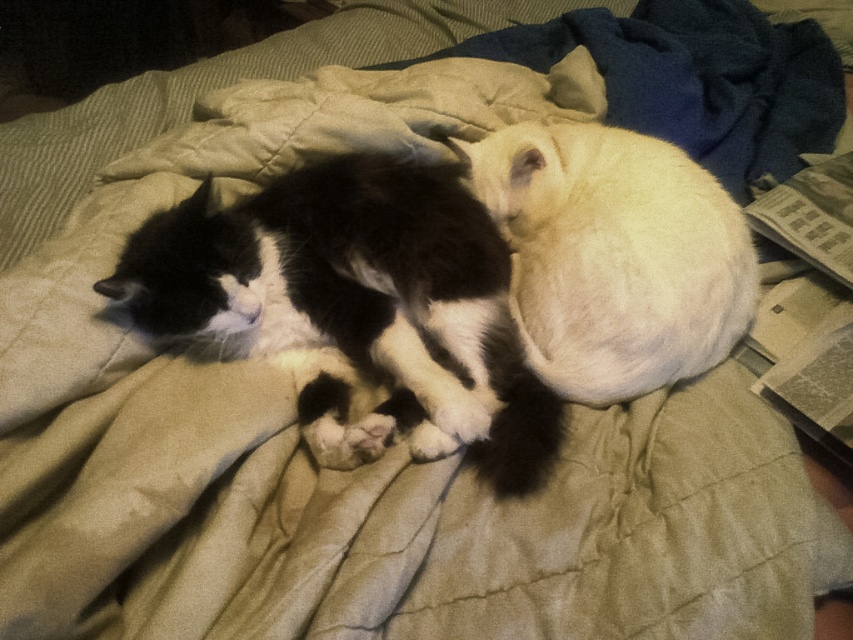
Question: Does black and white fur cat at center appear on the right side of white fluffy cat at center?

Choices:
 (A) yes
 (B) no

Answer: (B)

Question: Does black and white fur cat at center come in front of white fluffy cat at center?

Choices:
 (A) no
 (B) yes

Answer: (B)

Question: Can you confirm if black and white fur cat at center is positioned to the left of white fluffy cat at center?

Choices:
 (A) yes
 (B) no

Answer: (A)